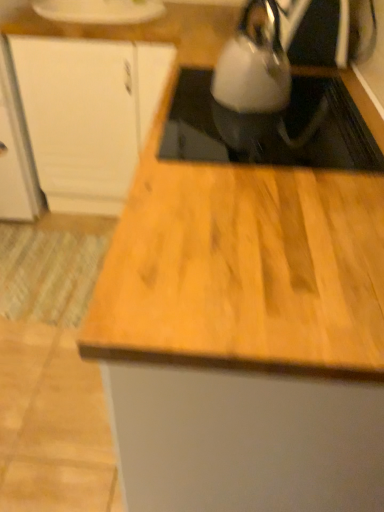
Find the location of a particular element. unoccupied region to the right of satin silver kettle at upper right is located at coordinates (327, 106).